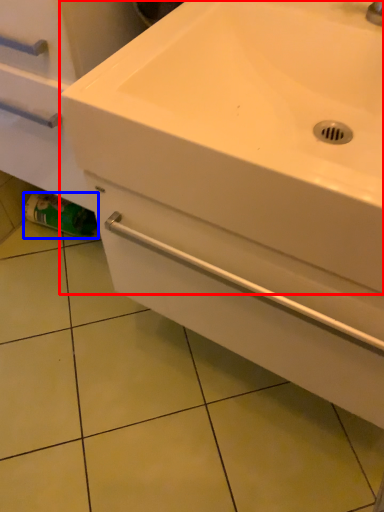
Question: Which point is further to the camera, sink (highlighted by a red box) or toilet paper (highlighted by a blue box)?

Choices:
 (A) sink
 (B) toilet paper

Answer: (B)